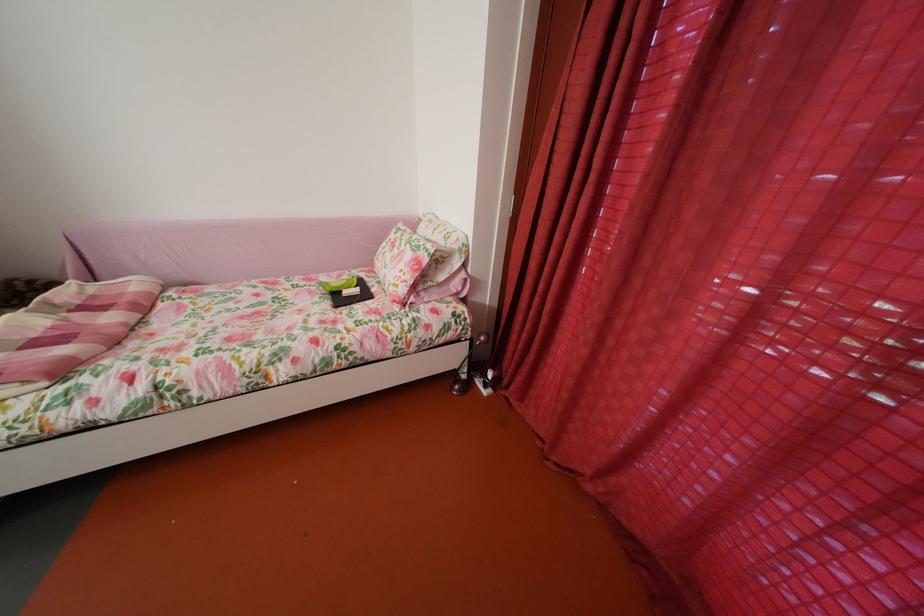
Which object does [400,262] point to?

This point indicates the floral patterned pillow.